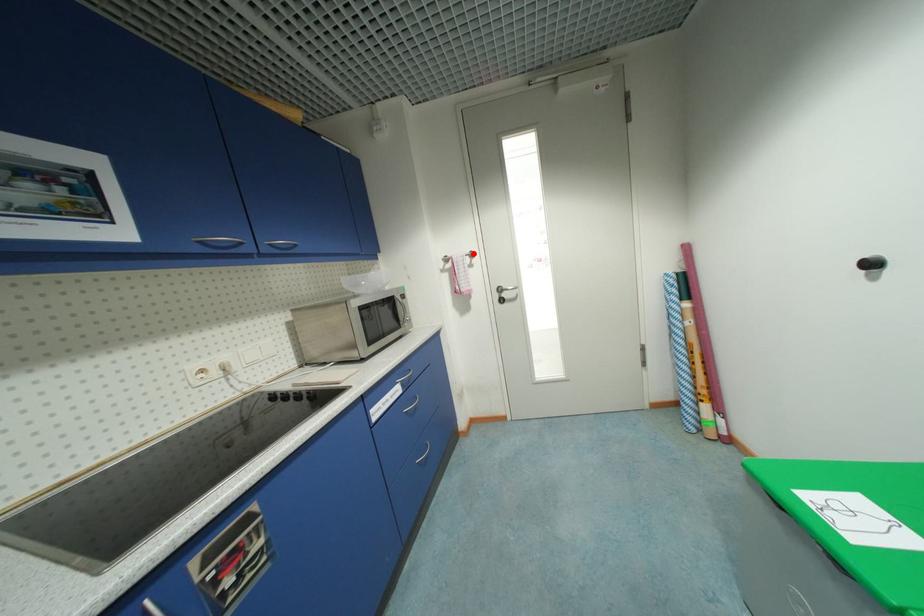
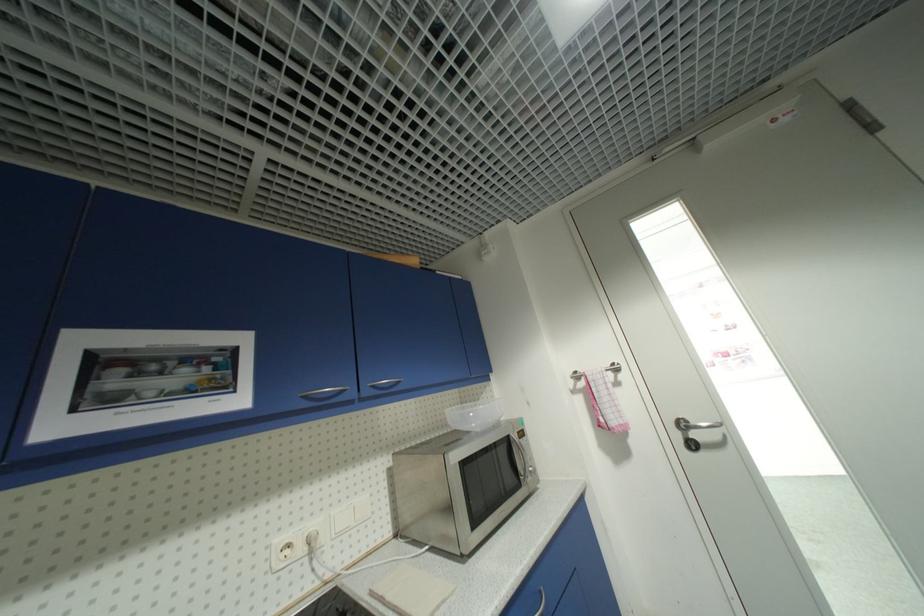
The point at the highlighted location is marked in the first image. Where is the corresponding point in the second image?

(614, 367)